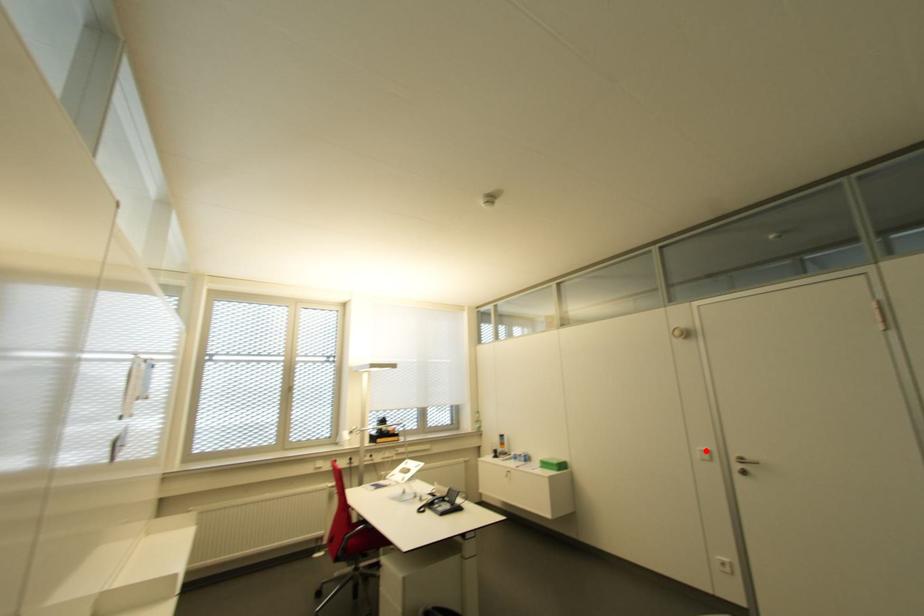
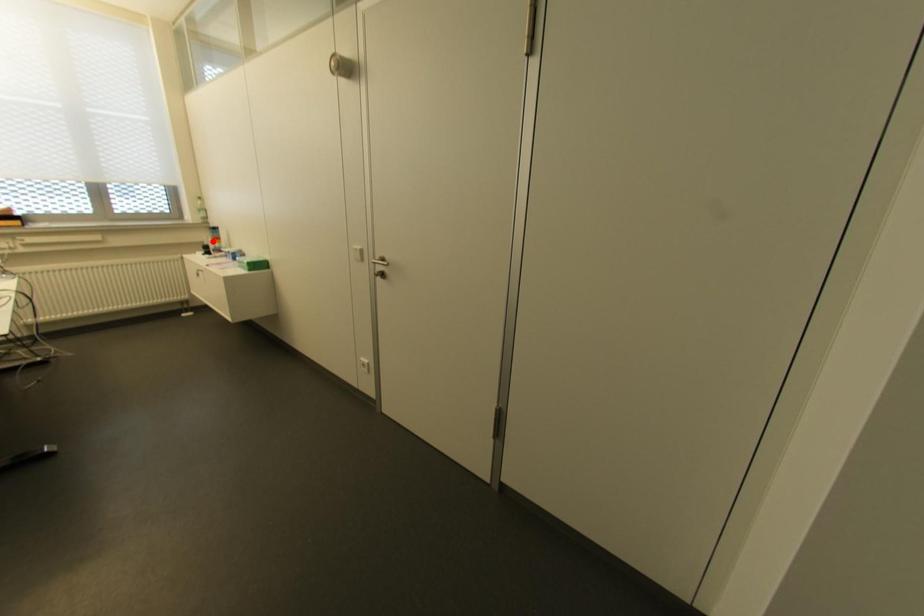
I am providing you with two images of the same scene from different viewpoints. A red point is marked on the first image and another point is marked on the second image. Are the points marked in image1 and image2 representing the same 3D position?

No